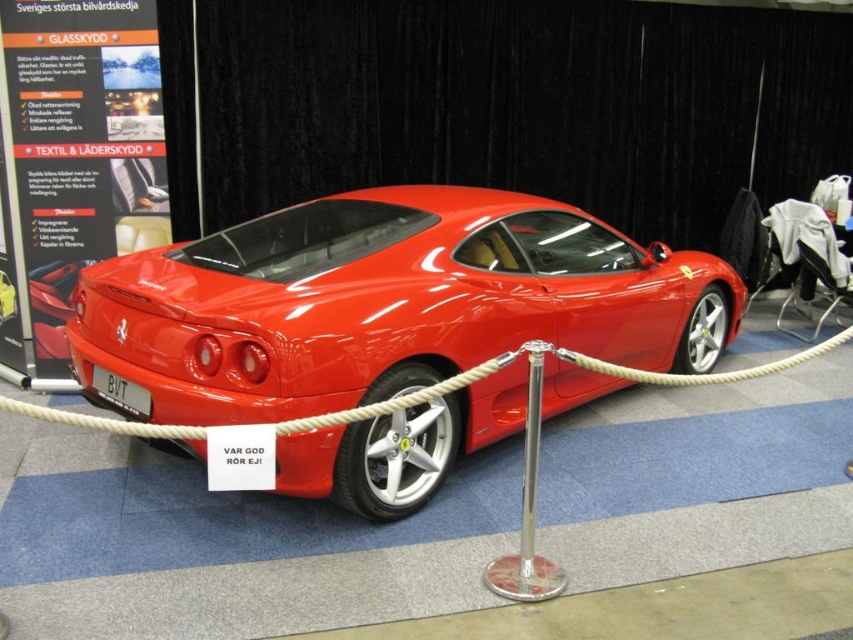
Question: Is shiny red ferrari at center closer to the viewer compared to polished silver pole at center?

Choices:
 (A) no
 (B) yes

Answer: (A)

Question: Can you confirm if white rope at center is wider than glossy red car at center?

Choices:
 (A) yes
 (B) no

Answer: (A)

Question: Among these points, which one is nearest to the camera?

Choices:
 (A) (532, 588)
 (B) (660, 285)
 (C) (637, 376)

Answer: (A)

Question: Which of the following is the farthest from the observer?

Choices:
 (A) (376, 417)
 (B) (9, 291)

Answer: (B)

Question: Which object is farther from the camera taking this photo?

Choices:
 (A) polished silver pole at center
 (B) white rope at center

Answer: (A)

Question: Is shiny red ferrari at center wider than white rope at center?

Choices:
 (A) no
 (B) yes

Answer: (B)